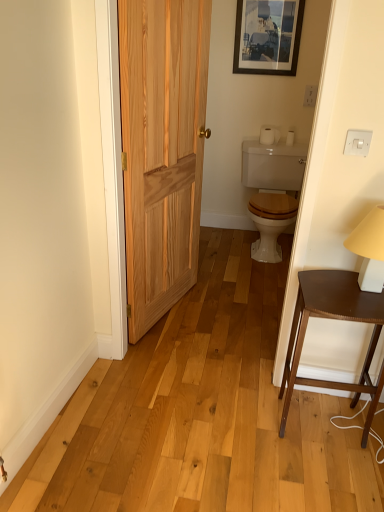
Question: Should I look upward or downward to see white matte toilet paper at upper right, positioned as the 1th toilet paper in right-to-left order?

Choices:
 (A) up
 (B) down

Answer: (A)

Question: Could you tell me if dark brown wood table at right is turned towards white plastic switch at upper right, the second electric outlet from the top?

Choices:
 (A) yes
 (B) no

Answer: (B)

Question: Is white plastic switch at upper right, the second electric outlet from the top, at the back of dark brown wood table at right?

Choices:
 (A) yes
 (B) no

Answer: (B)

Question: From the image's perspective, is dark brown wood table at right over white plastic switch at upper right, the second electric outlet from the top?

Choices:
 (A) no
 (B) yes

Answer: (A)

Question: Is dark brown wood table at right next to white plastic switch at upper right, placed as the 2th electric outlet when sorted from right to left?

Choices:
 (A) yes
 (B) no

Answer: (B)

Question: Is dark brown wood table at right in front of white plastic switch at upper right, the 1th electric outlet viewed from the left?

Choices:
 (A) no
 (B) yes

Answer: (B)

Question: Is dark brown wood table at right shorter than white plastic switch at upper right, which is the 2th electric outlet in back-to-front order?

Choices:
 (A) no
 (B) yes

Answer: (A)

Question: From the image's perspective, is white glossy toilet at center on top of white plastic switch at upper right, positioned as the 1th electric outlet in bottom-to-top order?

Choices:
 (A) yes
 (B) no

Answer: (A)

Question: From a real-world perspective, is white glossy toilet at center on white plastic switch at upper right, which is the 2th electric outlet in back-to-front order?

Choices:
 (A) yes
 (B) no

Answer: (B)

Question: Is white glossy toilet at center oriented towards white plastic switch at upper right, placed as the 2th electric outlet when sorted from right to left?

Choices:
 (A) yes
 (B) no

Answer: (A)

Question: Considering the relative sizes of white glossy toilet at center and white plastic switch at upper right, placed as the 2th electric outlet when sorted from right to left, in the image provided, is white glossy toilet at center thinner than white plastic switch at upper right, placed as the 2th electric outlet when sorted from right to left,?

Choices:
 (A) no
 (B) yes

Answer: (A)

Question: From a real-world perspective, is white glossy toilet at center below white plastic switch at upper right, positioned as the 1th electric outlet in bottom-to-top order?

Choices:
 (A) yes
 (B) no

Answer: (A)

Question: Considering the relative positions of white glossy toilet at center and white plastic switch at upper right, which is the 1th electric outlet in front-to-back order, in the image provided, is white glossy toilet at center to the left of white plastic switch at upper right, which is the 1th electric outlet in front-to-back order, from the viewer's perspective?

Choices:
 (A) yes
 (B) no

Answer: (B)

Question: From a real-world perspective, is natural wood door at left physically above white matte table lamp at right?

Choices:
 (A) yes
 (B) no

Answer: (A)